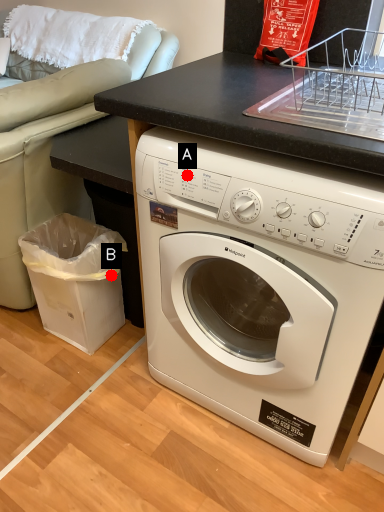
Question: Two points are circled on the image, labeled by A and B beside each circle. Which point is closer to the camera taking this photo?

Choices:
 (A) A is closer
 (B) B is closer

Answer: (A)